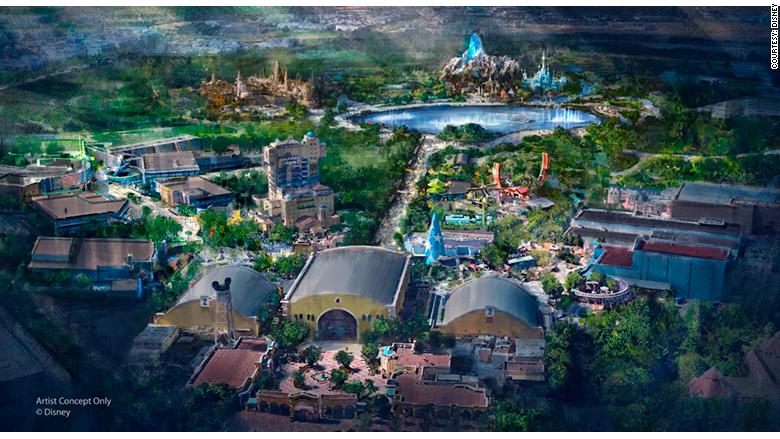
Where is `wall`? wall is located at coordinates (352, 312).